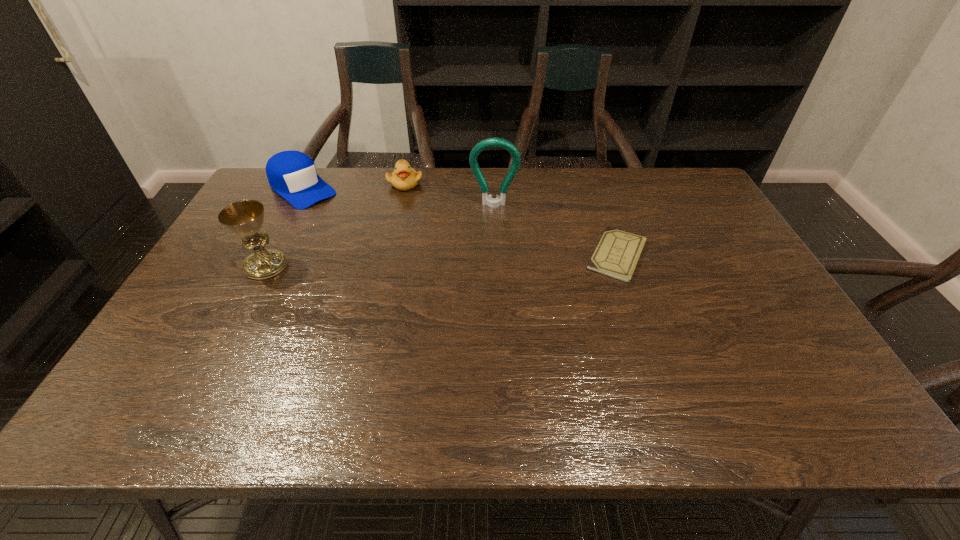
Where is `the second tallest object`? This screenshot has width=960, height=540. the second tallest object is located at coordinates pyautogui.click(x=245, y=218).

Image resolution: width=960 pixels, height=540 pixels. Identify the location of checkbook. (617, 253).

The height and width of the screenshot is (540, 960). Identify the location of the shortest object. (617, 253).

This screenshot has width=960, height=540. What are the coordinates of `duckling` in the screenshot? It's located at (404, 178).

Where is `the fourth tallest object`? The image size is (960, 540). the fourth tallest object is located at coordinates (404, 178).

Locate an element on the screen. The image size is (960, 540). baseball cap is located at coordinates (292, 174).

I want to click on the tallest object, so click(487, 199).

The height and width of the screenshot is (540, 960). Find the location of `bottle opener`. bottle opener is located at coordinates 487,199.

This screenshot has width=960, height=540. I want to click on vacant space located on the right of the second tallest object, so click(x=380, y=266).

The height and width of the screenshot is (540, 960). What are the coordinates of `vacant area situated on the front of the checkbook` in the screenshot? It's located at (654, 364).